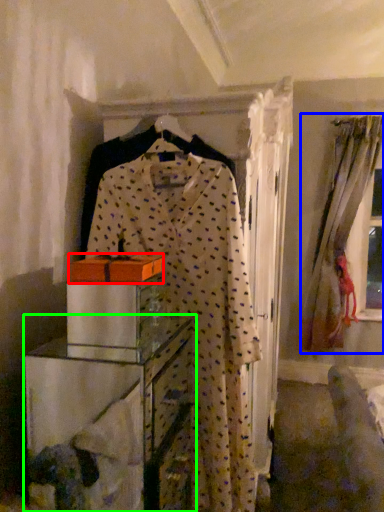
Question: Which is farther away from cardboard box (highlighted by a red box)? window (highlighted by a blue box) or furniture (highlighted by a green box)?

Choices:
 (A) window
 (B) furniture

Answer: (A)